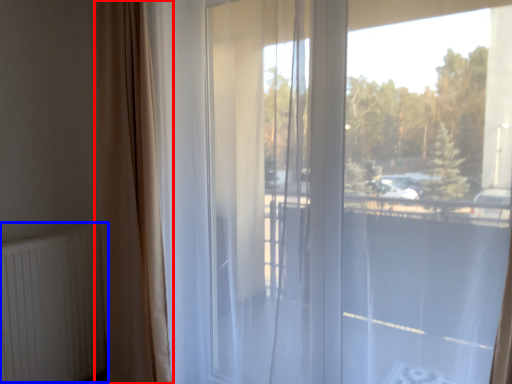
Question: Which point is closer to the camera, curtain (highlighted by a red box) or radiator (highlighted by a blue box)?

Choices:
 (A) curtain
 (B) radiator

Answer: (A)